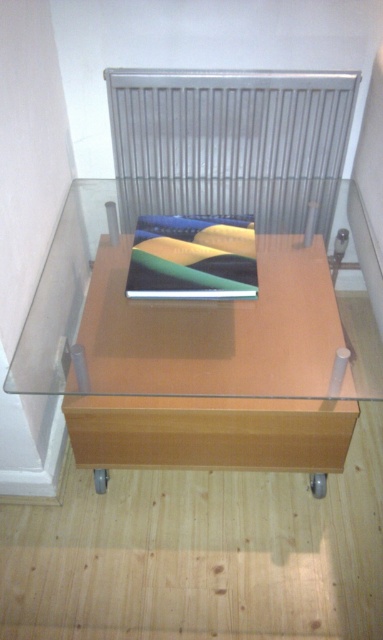
Which is below, light brown wood table at center or silver metallic radiator at upper center?

light brown wood table at center

Identify the location of light brown wood table at center. (214, 371).

Is point (188, 333) less distant than point (258, 204)?

Yes, it is.

In order to click on light brown wood table at center in this screenshot , I will do `click(214, 371)`.